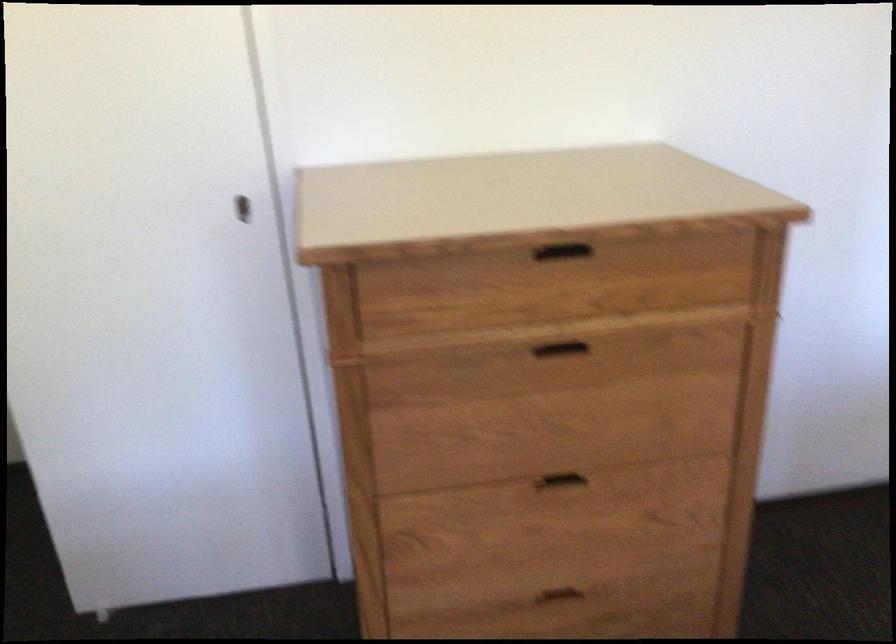
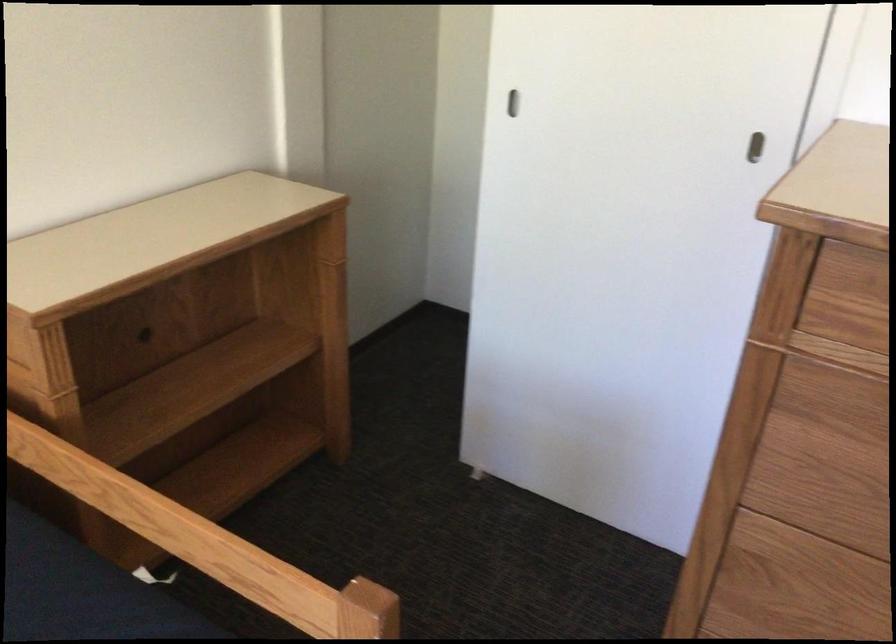
Find the pixel in the second image that matches (x=246, y=212) in the first image.

(754, 147)